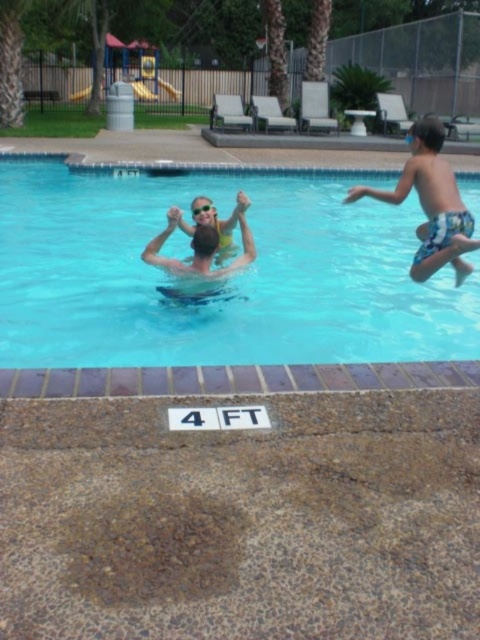
Question: Does clear blue water at center appear on the left side of clear plastic goggles at upper center?

Choices:
 (A) yes
 (B) no

Answer: (A)

Question: Can you confirm if clear blue water at center is positioned above blue printed trunks at right?

Choices:
 (A) no
 (B) yes

Answer: (B)

Question: Which object appears farthest from the camera in this image?

Choices:
 (A) clear plastic goggles at upper center
 (B) clear blue water at center

Answer: (B)

Question: Which point is closer to the camera?

Choices:
 (A) (396, 192)
 (B) (212, 204)

Answer: (A)

Question: Which point is farther to the camera?

Choices:
 (A) clear plastic goggles at upper center
 (B) blue printed trunks at right
 (C) clear blue water at center

Answer: (C)

Question: Does clear blue water at center appear on the left side of clear plastic goggles at upper center?

Choices:
 (A) yes
 (B) no

Answer: (A)